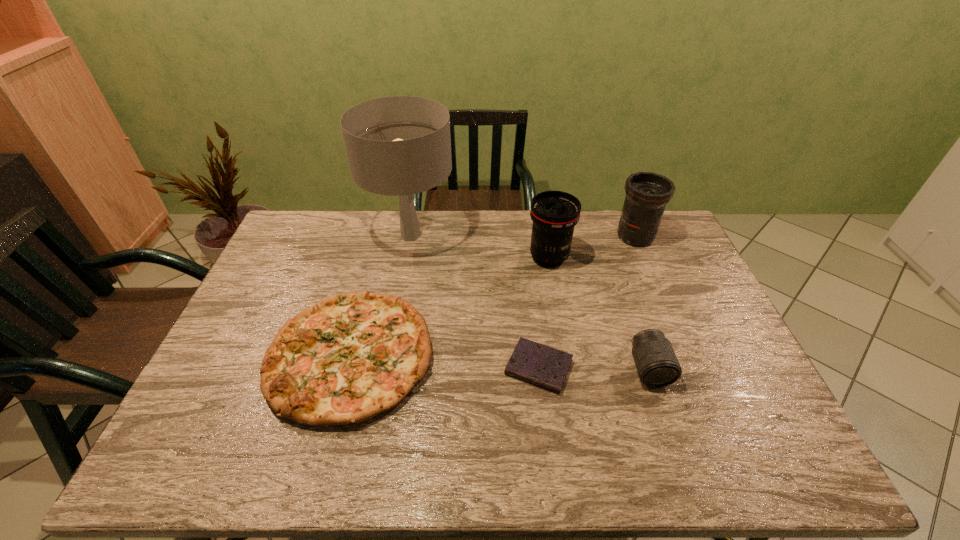
Where is `vacant area located 0.320m on the left of the diary`? The width and height of the screenshot is (960, 540). vacant area located 0.320m on the left of the diary is located at coordinates (385, 367).

The width and height of the screenshot is (960, 540). Find the location of `lampshade at the far edge`. lampshade at the far edge is located at coordinates (401, 145).

This screenshot has height=540, width=960. I want to click on object located at the left edge, so click(350, 357).

I want to click on object at the right edge, so click(647, 193).

At what (x,y) coordinates should I click in order to perform the action: click on object situated at the far right corner. Please return your answer as a coordinate pair (x, y). The width and height of the screenshot is (960, 540). Looking at the image, I should click on (647, 193).

In the image, there is a desktop. Identify the location of vacant space at the far edge. The width and height of the screenshot is (960, 540). (510, 211).

Locate an element on the screen. vacant area at the near edge is located at coordinates (618, 442).

Where is `free space at the left edge`? free space at the left edge is located at coordinates (223, 402).

Locate an element on the screen. The width and height of the screenshot is (960, 540). free space at the right edge is located at coordinates (687, 254).

Identify the location of vacant position at the far left corner of the desktop. point(298,213).